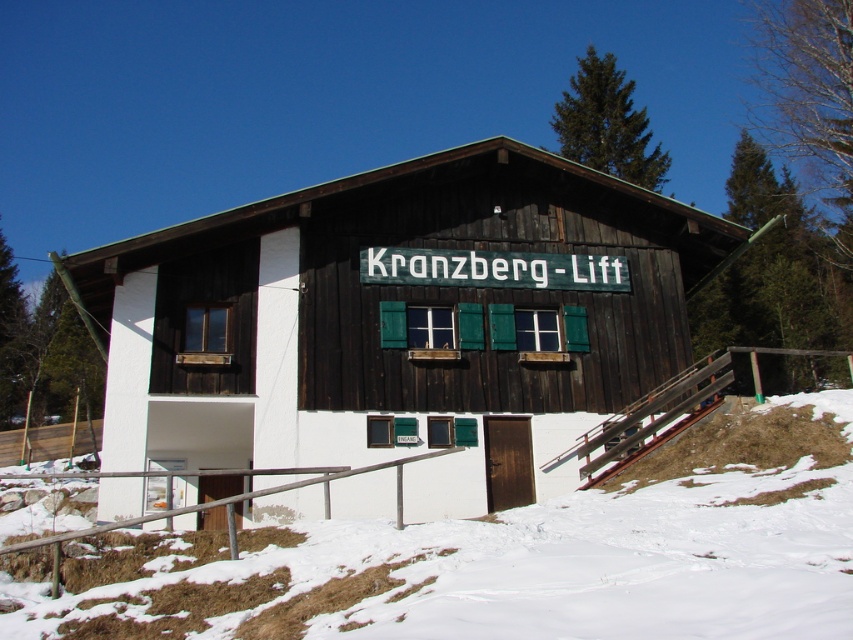
You are planning to build a small shed in your backyard. The shed needs to be as wide as the wooden cabin at center. Will it fit within the space currently occupied by the white powdery snow at lower left? Please explain why.

The wooden cabin at center is narrower than the white powdery snow at lower left. Since the shed needs to be as wide as the cabin, it will fit within the space occupied by the snow because the snow area is wider than the cabin.

You are standing at the entrance of the Kranzberg Lift building and want to place a decorative snowman exactly at the location of the white powdery snow at lower left. What are the coordinates where you should place the snowman?

The coordinates for the white powdery snow at lower left are at point [508,557], so you should place the snowman at those coordinates.